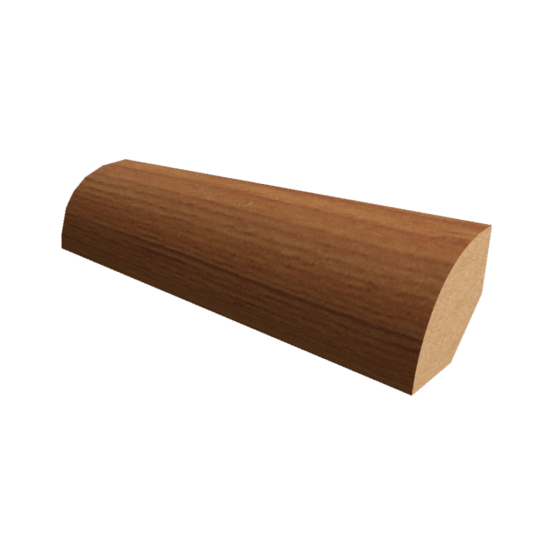
You are a GUI agent. You are given a task and a screenshot of the screen. Output one action in this format:
    pyautogui.click(x=<x>, y=<y>)
    Task: Click on the wood grain
    The image size is (550, 550).
    Given the screenshot: What is the action you would take?
    pyautogui.click(x=368, y=323), pyautogui.click(x=264, y=221), pyautogui.click(x=211, y=186)